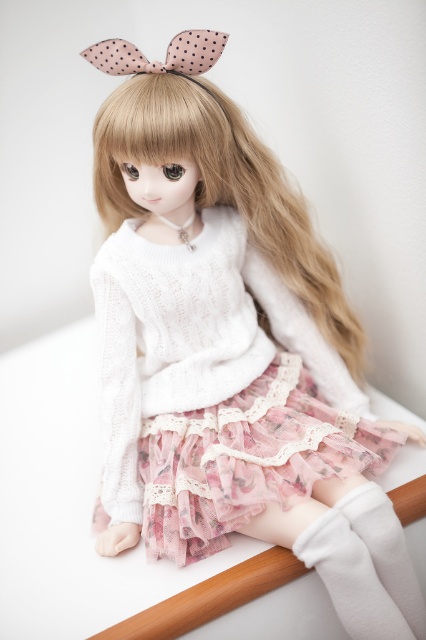
Question: Which object appears farthest from the camera in this image?

Choices:
 (A) pink dotted fabric bow at upper center
 (B) blondehair at center

Answer: (B)

Question: Which object appears closest to the camera in this image?

Choices:
 (A) blondehair at center
 (B) pink dotted fabric bow at upper center

Answer: (B)

Question: Does blondehair at center lie behind pink dotted fabric bow at upper center?

Choices:
 (A) no
 (B) yes

Answer: (B)

Question: Observing the image, what is the correct spatial positioning of blondehair at center in reference to pink dotted fabric bow at upper center?

Choices:
 (A) below
 (B) above

Answer: (A)

Question: Can you confirm if blondehair at center is positioned above pink dotted fabric bow at upper center?

Choices:
 (A) yes
 (B) no

Answer: (B)

Question: Which point is farther from the camera taking this photo?

Choices:
 (A) (161, 83)
 (B) (190, 33)

Answer: (A)